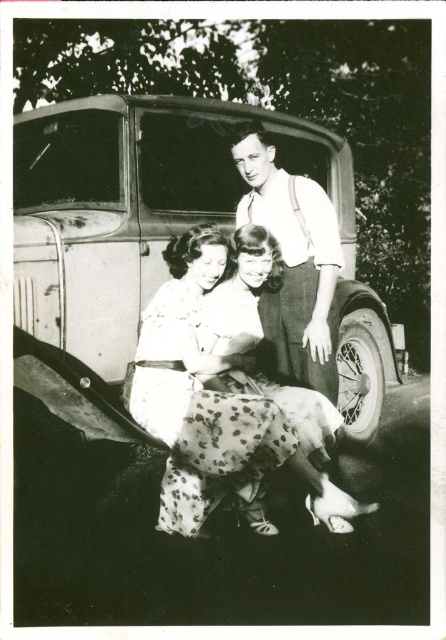
You are a photographer trying to capture a clear shot of both the metallic vintage car at center and the dotted fabric skirt at center in the image. Since you want to ensure both are visible in your frame, which object should you focus on first to account for their sizes?

The metallic vintage car at center is taller than the dotted fabric skirt at center, so you should focus on the metallic vintage car at center first to ensure its full height is captured before adjusting for the smaller dotted fabric skirt at center.

You are a photographer who needs to adjust the lighting for a scene similar to the one shown. The metallic vintage car at center and the white cotton shirt at upper center are the main subjects. If you want to ensure both are well lit, how far apart are these two subjects?

The metallic vintage car at center is 22.52 inches from the white cotton shirt at upper center, so you should position your lighting equipment to cover this distance between them to ensure both are well lit.